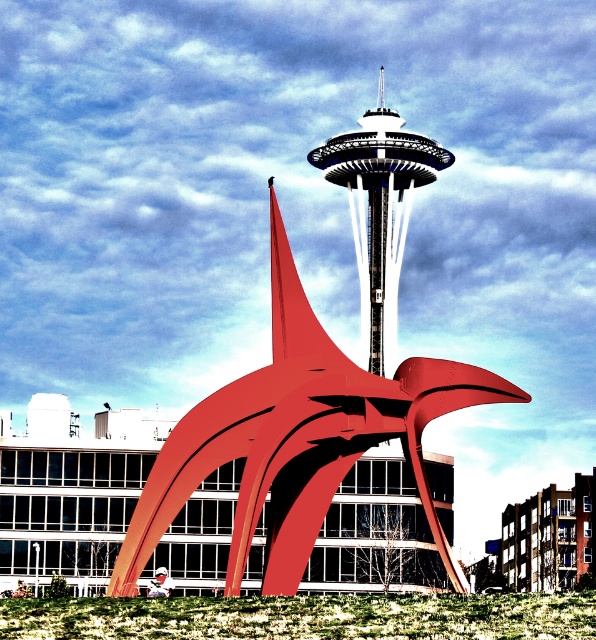
Question: In this image, where is metallic red sculpture at center located relative to white glossy space needle at center?

Choices:
 (A) above
 (B) below

Answer: (B)

Question: Which object is closer to the camera taking this photo?

Choices:
 (A) green grass at lower center
 (B) metallic red sculpture at center
 (C) white glossy space needle at center

Answer: (A)

Question: Is metallic red sculpture at center thinner than white glossy space needle at center?

Choices:
 (A) no
 (B) yes

Answer: (A)

Question: Which of the following is the closest to the observer?

Choices:
 (A) (244, 500)
 (B) (384, 316)
 (C) (72, 604)

Answer: (C)

Question: Which of these objects is positioned farthest from the green grass at lower center?

Choices:
 (A) metallic red sculpture at center
 (B) white glossy space needle at center

Answer: (B)

Question: Can you confirm if metallic red sculpture at center is thinner than white glossy space needle at center?

Choices:
 (A) yes
 (B) no

Answer: (B)